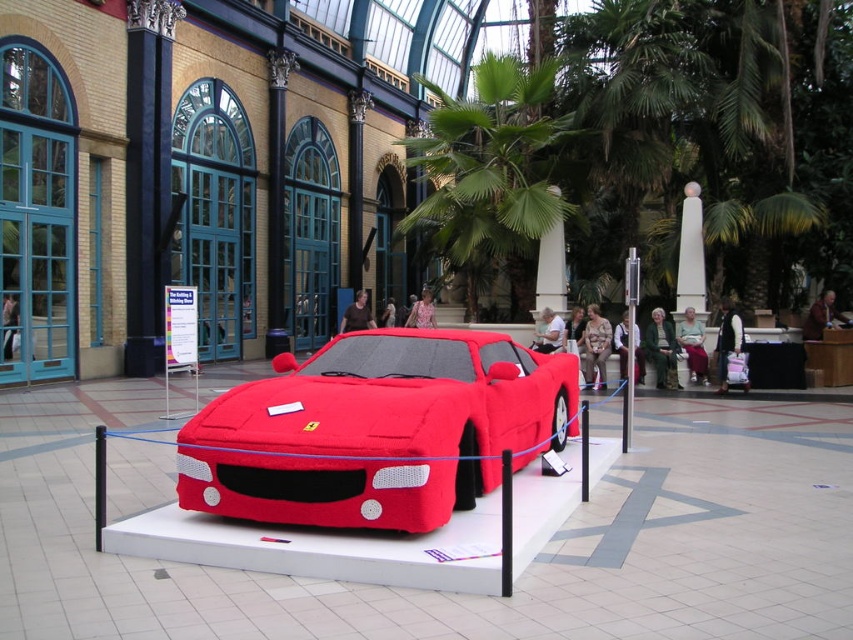
Question: Is matte fabric sports car at center smaller than green leafy palm tree at upper center?

Choices:
 (A) no
 (B) yes

Answer: (B)

Question: Which object appears farthest from the camera in this image?

Choices:
 (A) green leafy palm tree at upper center
 (B) matte fabric sports car at center

Answer: (A)

Question: Is the position of matte fabric sports car at center less distant than that of green leafy palm tree at upper center?

Choices:
 (A) yes
 (B) no

Answer: (A)

Question: Which of the following is the closest to the observer?

Choices:
 (A) (419, 349)
 (B) (463, 198)

Answer: (A)

Question: Where is matte fabric sports car at center located in relation to green leafy palm tree at upper center in the image?

Choices:
 (A) left
 (B) right

Answer: (B)